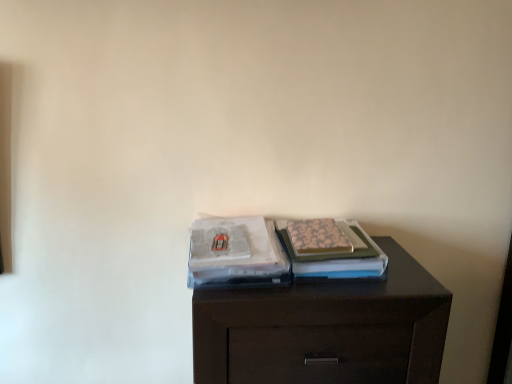
Identify the location of vacant area that is in front of patterned paper magazine at center, which ranks as the 2th magazine in left-to-right order. (336, 295).